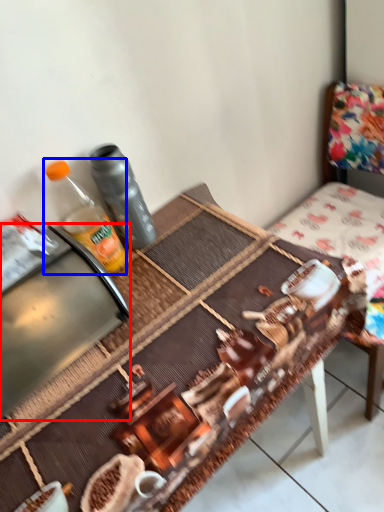
Question: Which object appears closest to the camera in this image, appliance (highlighted by a red box) or bottle (highlighted by a blue box)?

Choices:
 (A) appliance
 (B) bottle

Answer: (A)